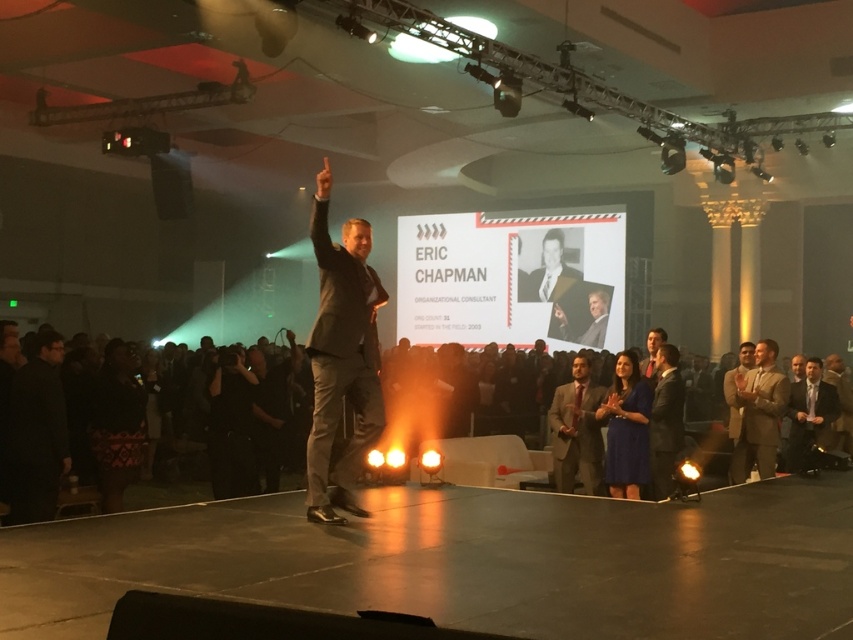
Between dark gray suit at center and matte gold suit at right, which one is positioned higher?

dark gray suit at center

Locate an element on the screen. The image size is (853, 640). dark gray suit at center is located at coordinates (341, 356).

Is dark suit at lower center bigger than matte gold suit at right?

Yes.

Looking at this image, can you confirm if dark suit at lower center is taller than matte gold suit at right?

No.

Does point (199, 477) lie in front of point (762, 365)?

No.

At what (x,y) coordinates should I click in order to perform the action: click on dark suit at lower center. Please return your answer as a coordinate pair (x, y). Looking at the image, I should click on (167, 490).

Measure the distance between dark gray suit at center and camera.

dark gray suit at center and camera are 4.94 meters apart from each other.

Looking at this image, is dark gray suit at center smaller than dark suit at lower center?

Yes, dark gray suit at center is smaller than dark suit at lower center.

The width and height of the screenshot is (853, 640). What do you see at coordinates (341, 356) in the screenshot?
I see `dark gray suit at center` at bounding box center [341, 356].

Locate an element on the screen. The image size is (853, 640). dark gray suit at center is located at coordinates (341, 356).